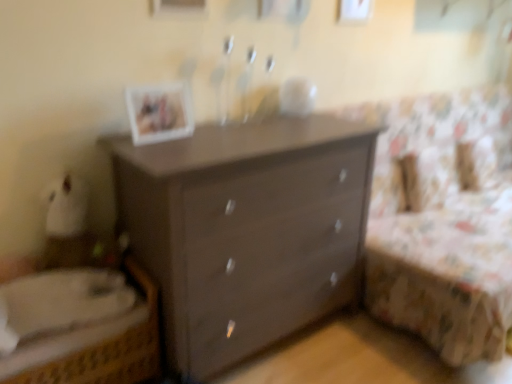
Question: From a real-world perspective, is matte brown dresser at center over matte white picture frame at upper center?

Choices:
 (A) no
 (B) yes

Answer: (A)

Question: Is matte brown dresser at center next to matte white picture frame at upper center and touching it?

Choices:
 (A) yes
 (B) no

Answer: (B)

Question: Does matte brown dresser at center have a greater height compared to matte white picture frame at upper center?

Choices:
 (A) no
 (B) yes

Answer: (B)

Question: Are matte brown dresser at center and matte white picture frame at upper center far apart?

Choices:
 (A) no
 (B) yes

Answer: (A)

Question: From the image's perspective, is matte brown dresser at center beneath matte white picture frame at upper center?

Choices:
 (A) yes
 (B) no

Answer: (A)

Question: From a real-world perspective, does matte brown dresser at center sit lower than matte white picture frame at upper center?

Choices:
 (A) yes
 (B) no

Answer: (A)

Question: Is matte white picture frame at upper center oriented towards floral fabric bed at right?

Choices:
 (A) yes
 (B) no

Answer: (B)

Question: Can you confirm if matte white picture frame at upper center is taller than floral fabric bed at right?

Choices:
 (A) no
 (B) yes

Answer: (A)

Question: From a real-world perspective, does matte white picture frame at upper center stand above floral fabric bed at right?

Choices:
 (A) yes
 (B) no

Answer: (A)

Question: Considering the relative sizes of matte white picture frame at upper center and floral fabric bed at right in the image provided, is matte white picture frame at upper center bigger than floral fabric bed at right?

Choices:
 (A) no
 (B) yes

Answer: (A)

Question: From a real-world perspective, is matte white picture frame at upper center located beneath floral fabric bed at right?

Choices:
 (A) yes
 (B) no

Answer: (B)

Question: Considering the relative sizes of matte white picture frame at upper center and floral fabric bed at right in the image provided, is matte white picture frame at upper center thinner than floral fabric bed at right?

Choices:
 (A) yes
 (B) no

Answer: (A)

Question: Is matte brown dresser at center further to camera compared to floral fabric bed at right?

Choices:
 (A) yes
 (B) no

Answer: (B)